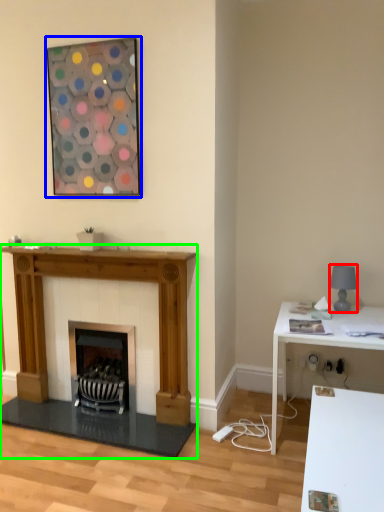
Question: Which object is the farthest from lamp (highlighted by a red box)? Choose among these: picture frame (highlighted by a blue box) or fireplace (highlighted by a green box).

Choices:
 (A) picture frame
 (B) fireplace

Answer: (A)